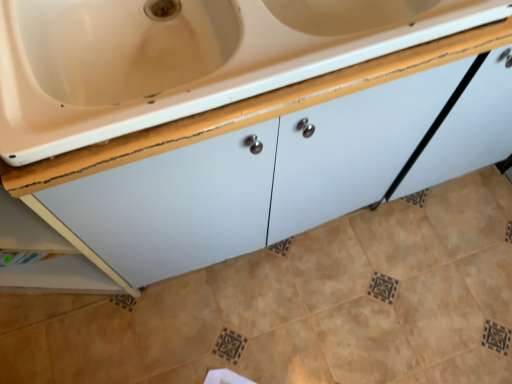
Question: Does white glossy cabinet at center have a greater width compared to beige ceramic tile at center?

Choices:
 (A) no
 (B) yes

Answer: (A)

Question: Is white glossy cabinet at center at the left side of beige ceramic tile at center?

Choices:
 (A) yes
 (B) no

Answer: (A)

Question: Would you say white glossy cabinet at center contains beige ceramic tile at center?

Choices:
 (A) no
 (B) yes

Answer: (A)

Question: Does white glossy cabinet at center have a lesser width compared to beige ceramic tile at center?

Choices:
 (A) no
 (B) yes

Answer: (B)

Question: Does white glossy cabinet at center lie in front of beige ceramic tile at center?

Choices:
 (A) yes
 (B) no

Answer: (A)

Question: Can you confirm if white glossy cabinet at center is positioned to the right of beige ceramic tile at center?

Choices:
 (A) no
 (B) yes

Answer: (A)

Question: Would you consider beige ceramic tile at center to be distant from white glossy cabinet at center?

Choices:
 (A) yes
 (B) no

Answer: (B)

Question: From a real-world perspective, is beige ceramic tile at center located beneath white glossy cabinet at center?

Choices:
 (A) no
 (B) yes

Answer: (B)

Question: Does beige ceramic tile at center lie in front of white glossy cabinet at center?

Choices:
 (A) yes
 (B) no

Answer: (B)

Question: Is beige ceramic tile at center taller than white glossy cabinet at center?

Choices:
 (A) yes
 (B) no

Answer: (B)

Question: Is beige ceramic tile at center at the left side of white glossy cabinet at center?

Choices:
 (A) yes
 (B) no

Answer: (B)

Question: Can you confirm if beige ceramic tile at center is shorter than white glossy cabinet at center?

Choices:
 (A) yes
 (B) no

Answer: (A)

Question: Based on their positions, is beige ceramic tile at center located to the left or right of white glossy cabinet at center?

Choices:
 (A) right
 (B) left

Answer: (A)